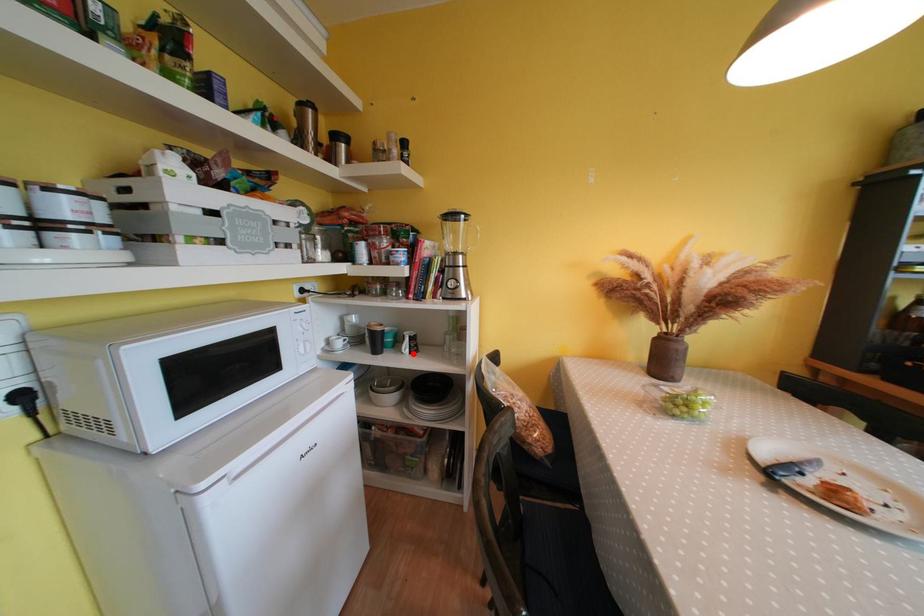
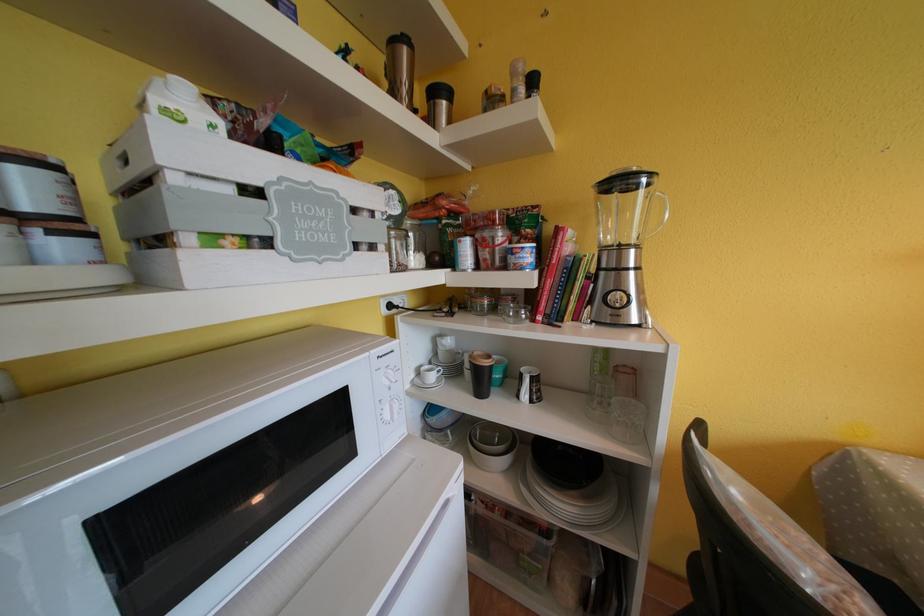
The point at the highlighted location is marked in the first image. Where is the corresponding point in the second image?

(533, 400)